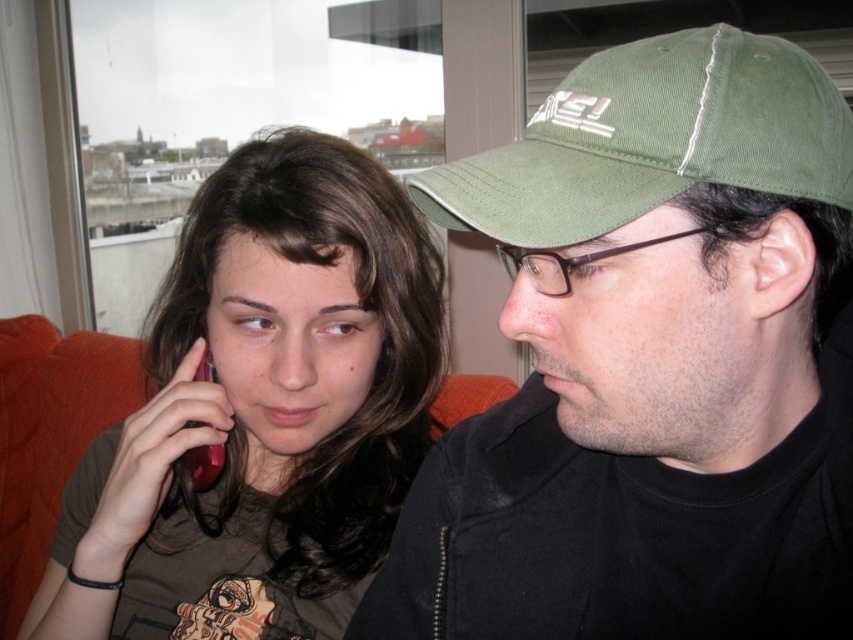
You are a photographer taking a picture of the two people. You notice the green fabric cap at upper right and the skinny green cap at right. Which one is positioned lower in the image?

The green fabric cap at upper right is below the skinny green cap at right, so the green fabric cap at upper right is positioned lower in the image.

You are standing 10 inches away from the point at coordinates point (514, 221). If you want to move closer to it, how much closer can you get without overlapping?

The distance of point (514, 221) from viewer is 15.45 inches. Since you are already 10 inches away, you can move 5.45 inches closer to reach the point without overlapping.